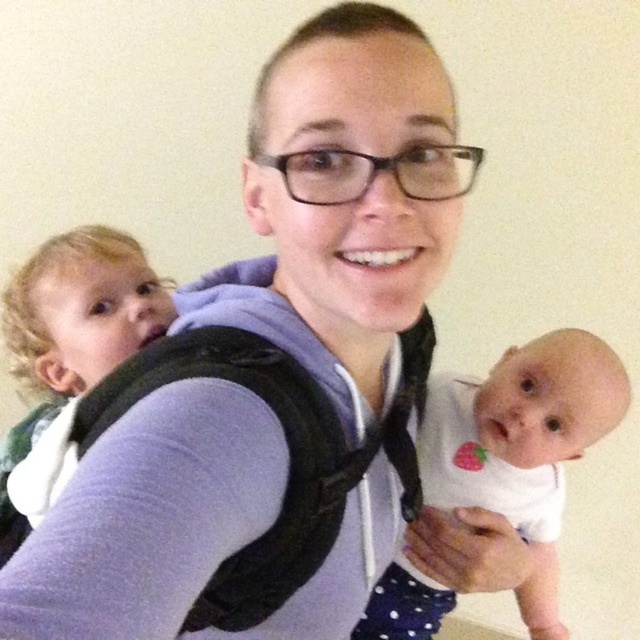
You are a photographer who wants to ensure the white soft fabric baby at center is in focus. Based on its position, where should you adjust the camera focus point to?

The white soft fabric baby at center is located at point (522, 445), so you should adjust the camera focus point to that coordinate to ensure it is in focus.

You are a photographer setting up a studio shoot. You need to ensure that the white soft fabric baby at center and the blonde hair baby carrier at upper left are both visible in the frame. Given that the camera has a fixed focal length, which object should you prioritize positioning closer to the camera to ensure it takes up more space in the photo?

The white soft fabric baby at center should be positioned closer to the camera because its width is larger than the blonde hair baby carrier at upper left, so moving it closer will ensure it occupies more of the frame without overcrowding the image.